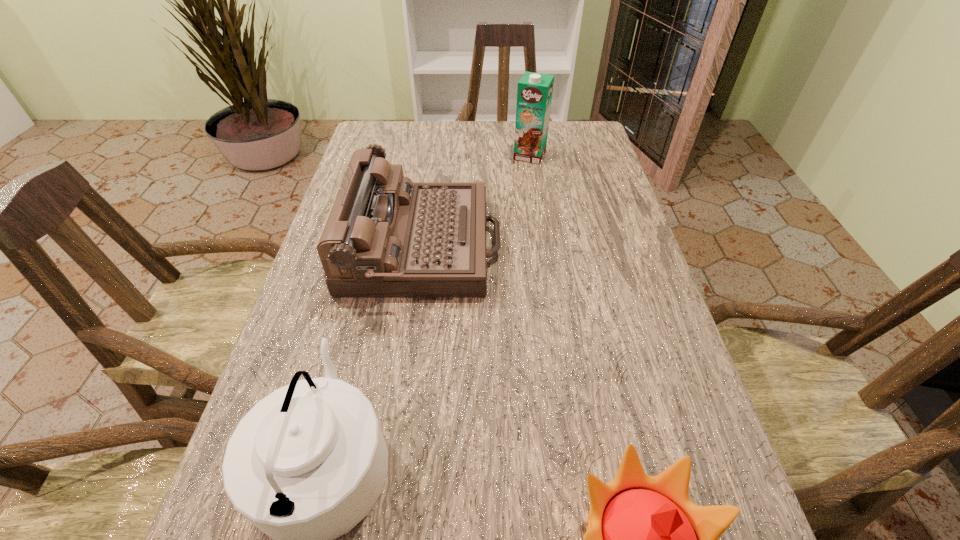
Select which object is the closest to the tallest object. Please provide its 2D coordinates. Your answer should be formatted as a tuple, i.e. [(x, y)], where the tuple contains the x and y coordinates of a point satisfying the conditions above.

[(386, 236)]

Locate an element on the screen. This screenshot has width=960, height=540. vacant position in the image that satisfies the following two spatial constraints: 1. on the front side of the carton; 2. on the keyboard of the typewriter is located at coordinates (543, 245).